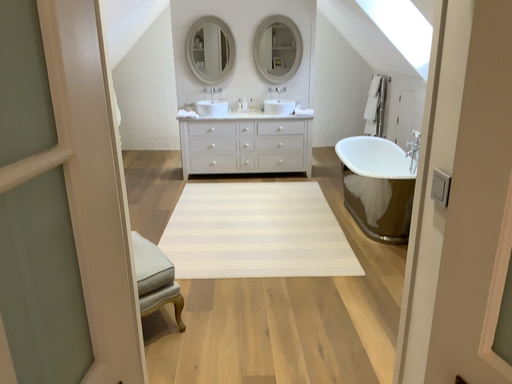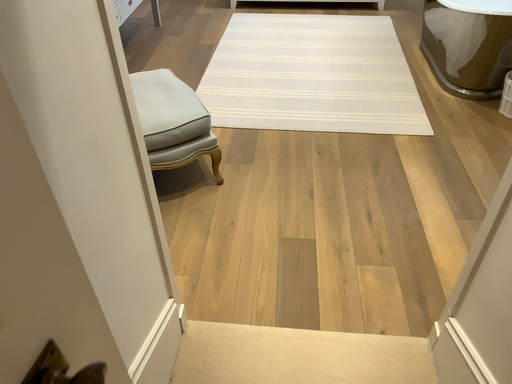
Question: Which way did the camera rotate in the video?

Choices:
 (A) rotated downward
 (B) rotated upward

Answer: (A)